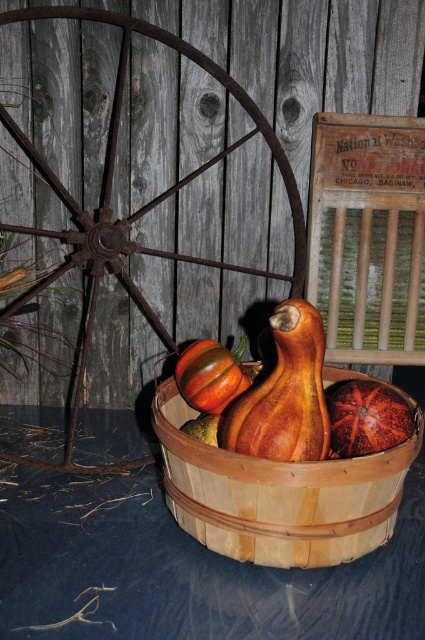
You are an artist planning to paint this scene. You want to ensure the rusty metal wagon wheel at left and the wooden gourd at center are proportionally accurate. Which object should you make wider in your painting to maintain the correct proportions?

The rusty metal wagon wheel at left should be wider than the wooden gourd at center in your painting to maintain the correct proportions, as the description states the wagon wheel is wider than the gourd.

You are standing in the scene and want to place a small decorative item exactly at the center of the image. Given the position of the rusty metal wagon wheel at left, where should you place the item to ensure it is centered?

The center of the image is at point coordinates of (212,320). The rusty metal wagon wheel at left is located at point coordinates of (138,209). To place the item at the center, you should move it towards the upper right direction from the wagon wheel until it reaches the center coordinates of (212,320).